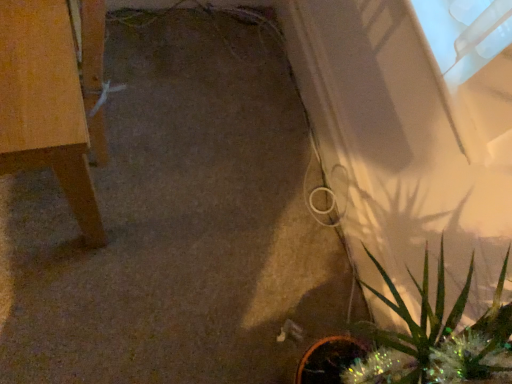
Describe the element at coordinates (53, 99) in the screenshot. The height and width of the screenshot is (384, 512). I see `light brown wood table at left` at that location.

You are a GUI agent. You are given a task and a screenshot of the screen. Output one action in this format:
    pyautogui.click(x=<x>, y=<y>)
    Task: Click on the light brown wood table at left
    This screenshot has height=384, width=512.
    Given the screenshot: What is the action you would take?
    pyautogui.click(x=53, y=99)

In order to click on light brown wood table at left in this screenshot , I will do `click(53, 99)`.